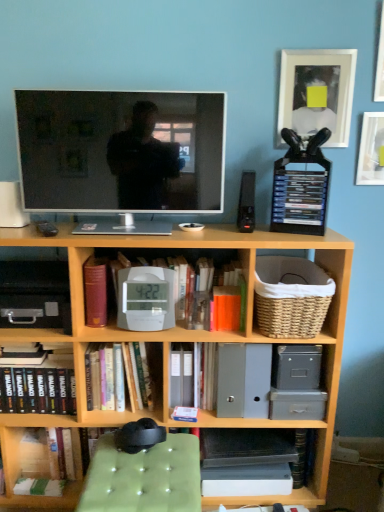
Locate an element on the screen. The height and width of the screenshot is (512, 384). vacant space in front of black plastic speaker at upper right is located at coordinates (254, 236).